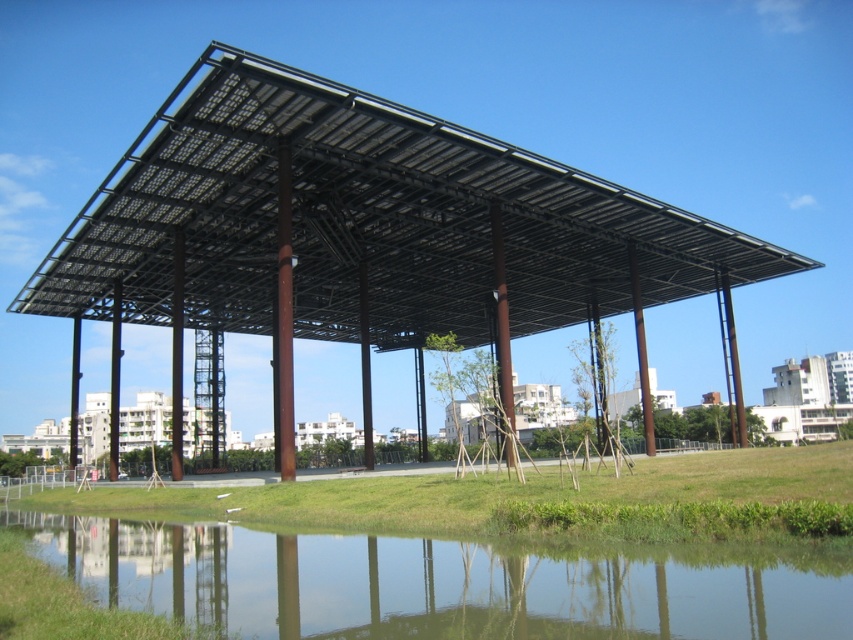
You are standing in front of the structure and want to see the reflection of the black metal roof at center in the clear water at lower center. Is the reflection visible in the water?

The clear water at lower center is behind the black metal roof at center, so the reflection of the black metal roof at center would not be visible in the clear water at lower center because the water is located behind the roof, making it impossible for the roof to reflect onto the water surface.

You are planning to install a new solar panel system. You see the black metal roof at center and the clear water at lower center in the image. Which of these two can you place the solar panels on?

The black metal roof at center is bigger than clear water at lower center, so you can place the solar panels on the black metal roof at center.